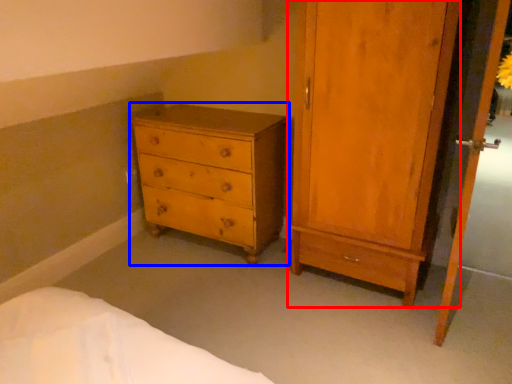
Question: Among these objects, which one is farthest to the camera, door (highlighted by a red box) or chest of drawers (highlighted by a blue box)?

Choices:
 (A) door
 (B) chest of drawers

Answer: (B)